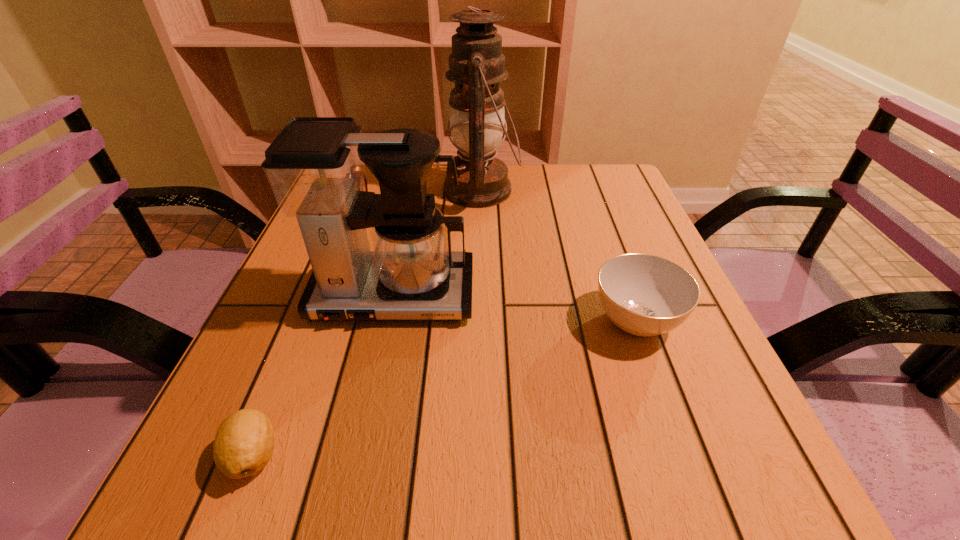
Where is `vacant space that satisfies the following two spatial constraints: 1. at the front of the second tallest object where the controls are located; 2. on the left side of the second shortest object`? vacant space that satisfies the following two spatial constraints: 1. at the front of the second tallest object where the controls are located; 2. on the left side of the second shortest object is located at coordinates (388, 321).

Where is `free space in the image that satisfies the following two spatial constraints: 1. at the front of the second tallest object where the controls are located; 2. on the left side of the chinaware`? This screenshot has height=540, width=960. free space in the image that satisfies the following two spatial constraints: 1. at the front of the second tallest object where the controls are located; 2. on the left side of the chinaware is located at coordinates (388, 321).